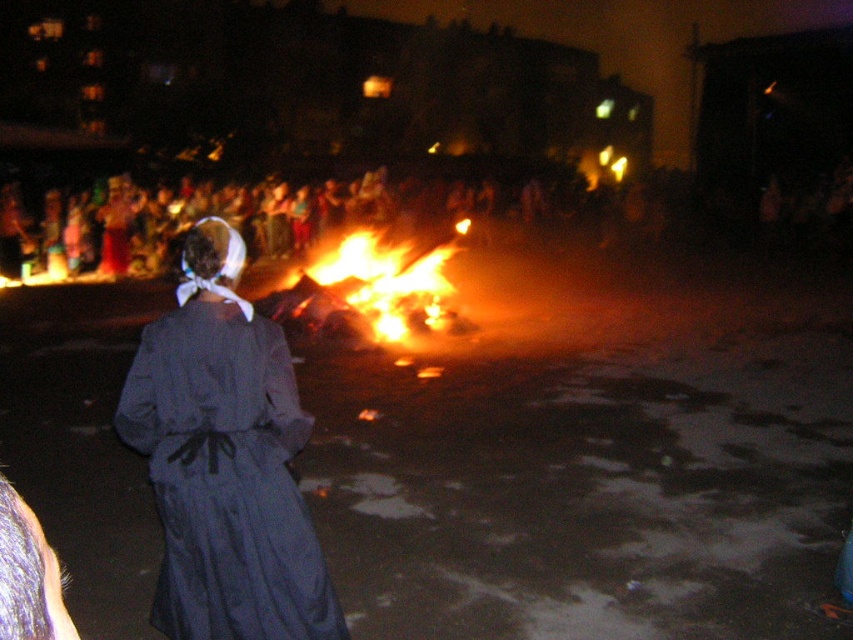
You are a photographer trying to capture the scene of the dark gray fabric dress at center and the flaming wood at center. Based on their sizes, which object would appear larger in your photo?

The dark gray fabric dress at center appears larger in the photo because it is much taller than the flaming wood at center.

You are standing at the edge of the scene and want to hand a torch to the person wearing the dark gray fabric dress at center. The torch is 2 meters long. Can you reach them without moving closer?

The distance between you and the dark gray fabric dress at center is 9.26 feet, which is approximately 2.82 meters. Since the torch is only 2 meters long, you cannot reach them without moving closer.

In the scene shown: You are standing in the nighttime scene with the bonfire. You see a point at coordinates (x=225, y=460). Which object is this point located on?

The point at (x=225, y=460) is located on the dark gray fabric dress at center.